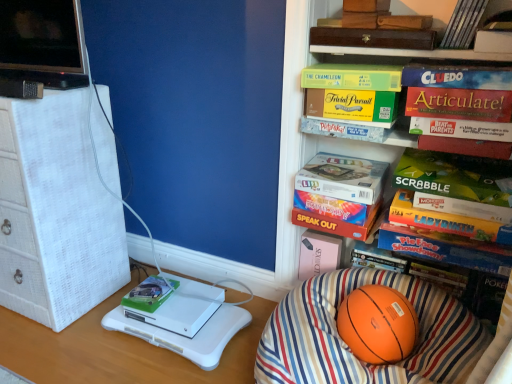
Find the location of a particular element. The width and height of the screenshot is (512, 384). vacant space to the right of green matte book at lower left, placed as the fourth book when sorted from top to bottom is located at coordinates (192, 301).